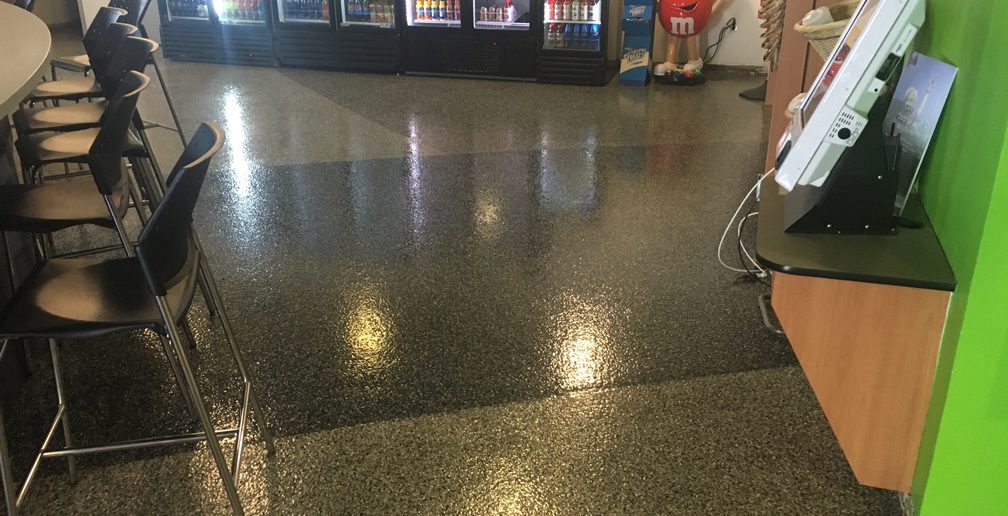
Image resolution: width=1008 pixels, height=516 pixels. I want to click on countertop, so click(x=894, y=245).